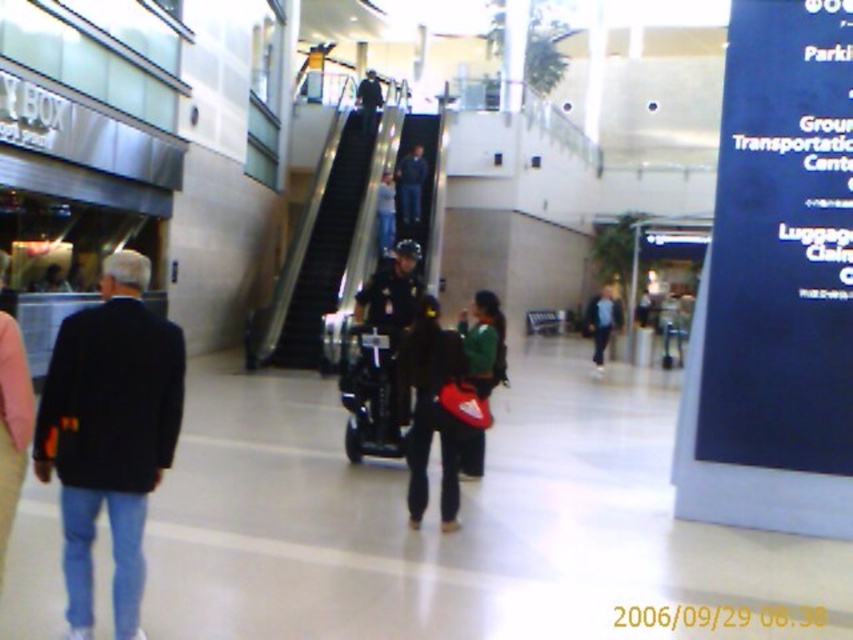
Question: Is black plastic escalator at upper center further to the viewer compared to dark blue uniform at upper center?

Choices:
 (A) no
 (B) yes

Answer: (A)

Question: Which object is farther from the camera taking this photo?

Choices:
 (A) black plastic escalator at upper center
 (B) black matte jacket at center
 (C) blue jeans at upper center

Answer: (C)

Question: Does black matte jacket at center have a smaller size compared to dark blue jeans at center?

Choices:
 (A) no
 (B) yes

Answer: (A)

Question: Which point is closer to the camera?

Choices:
 (A) dark blue jeans at center
 (B) green matte jacket at center
 (C) dark blue jacket at center
 (D) blue jeans at upper center

Answer: (B)

Question: Can you confirm if dark blue jeans at center is smaller than dark blue uniform at upper center?

Choices:
 (A) yes
 (B) no

Answer: (B)

Question: Which point is closer to the camera?

Choices:
 (A) (389, 236)
 (B) (445, 486)
 (C) (366, 86)
 (D) (421, 177)

Answer: (B)